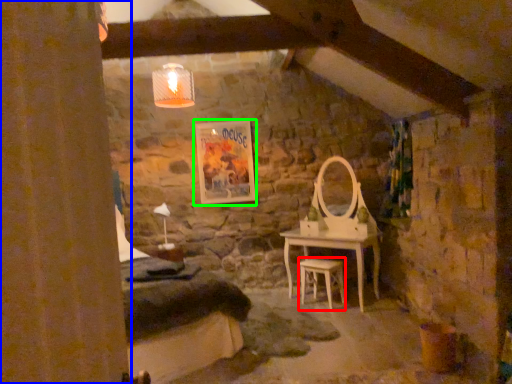
Question: Considering the real-world distances, which object is closest to stool (highlighted by a red box)? curtain (highlighted by a blue box) or picture frame (highlighted by a green box).

Choices:
 (A) curtain
 (B) picture frame

Answer: (B)